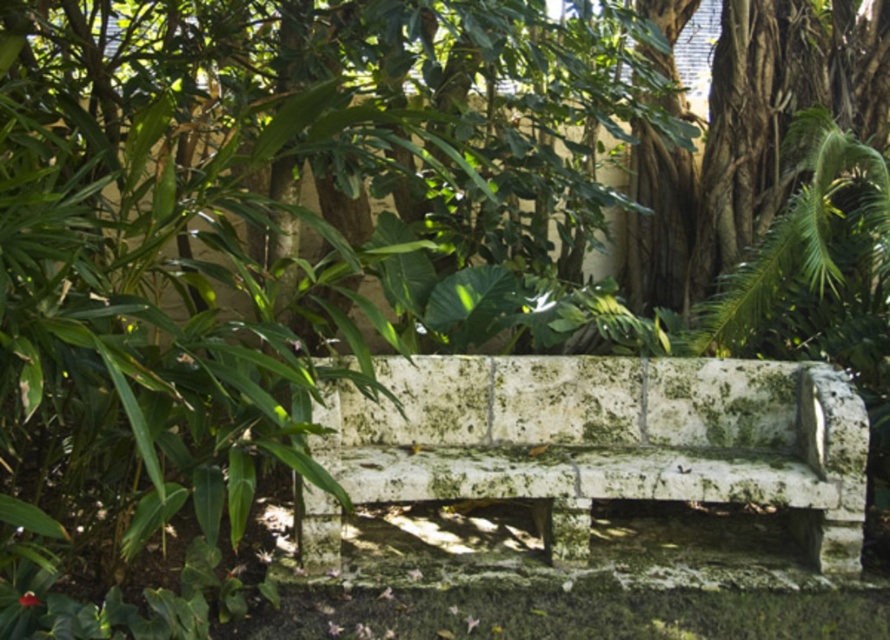
Question: In this image, where is mossy stone bench at center located relative to green mossy stone bench at upper center?

Choices:
 (A) above
 (B) below

Answer: (B)

Question: Can you confirm if mossy stone bench at center is thinner than green mossy stone bench at upper center?

Choices:
 (A) yes
 (B) no

Answer: (B)

Question: Does mossy stone bench at center appear on the right side of green mossy stone bench at upper center?

Choices:
 (A) yes
 (B) no

Answer: (B)

Question: Which point is farther to the camera?

Choices:
 (A) (572, 554)
 (B) (781, 122)

Answer: (B)

Question: Which object appears farthest from the camera in this image?

Choices:
 (A) mossy stone bench at center
 (B) green mossy stone bench at upper center

Answer: (B)